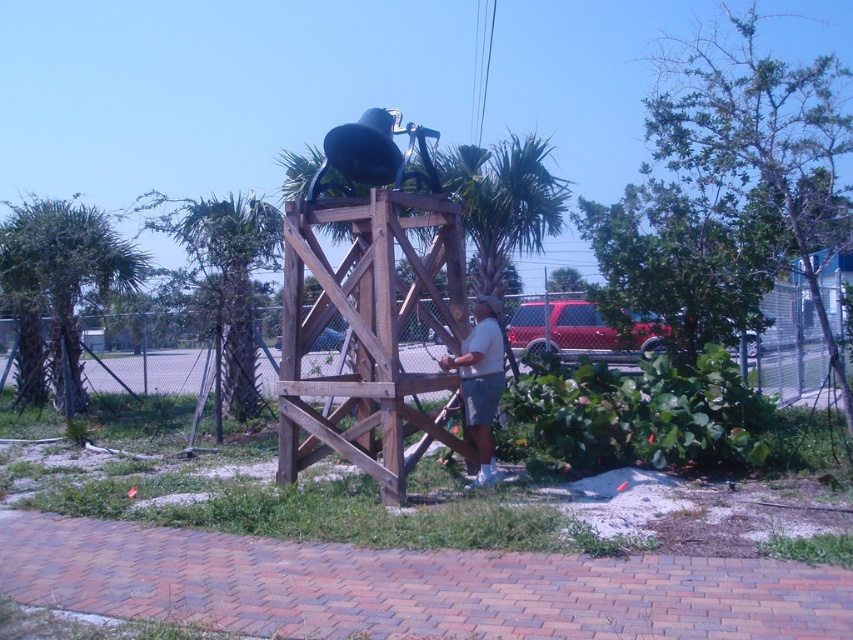
Who is more forward, (235, 316) or (494, 339)?

Point (494, 339)

Does green leafy palm tree at center have a lesser width compared to white cotton shirt at center?

Incorrect, green leafy palm tree at center's width is not less than white cotton shirt at center's.

Find the location of a particular element. This screenshot has width=853, height=640. green leafy palm tree at center is located at coordinates (230, 278).

Can you confirm if green leafy palm tree at left is bigger than green leafy palm tree at center?

Actually, green leafy palm tree at left might be smaller than green leafy palm tree at center.

Is green leafy palm tree at left closer to the viewer compared to green leafy palm tree at center?

No.

This screenshot has width=853, height=640. What are the coordinates of `green leafy palm tree at left` in the screenshot? It's located at (64, 275).

Is point (15, 205) farther from viewer compared to point (486, 369)?

That is True.

Consider the image. Between green leafy palm tree at left and white cotton shirt at center, which one has more height?

green leafy palm tree at left

What do you see at coordinates (64, 275) in the screenshot? This screenshot has width=853, height=640. I see `green leafy palm tree at left` at bounding box center [64, 275].

At what (x,y) coordinates should I click in order to perform the action: click on green leafy palm tree at left. Please return your answer as a coordinate pair (x, y). This screenshot has width=853, height=640. Looking at the image, I should click on (64, 275).